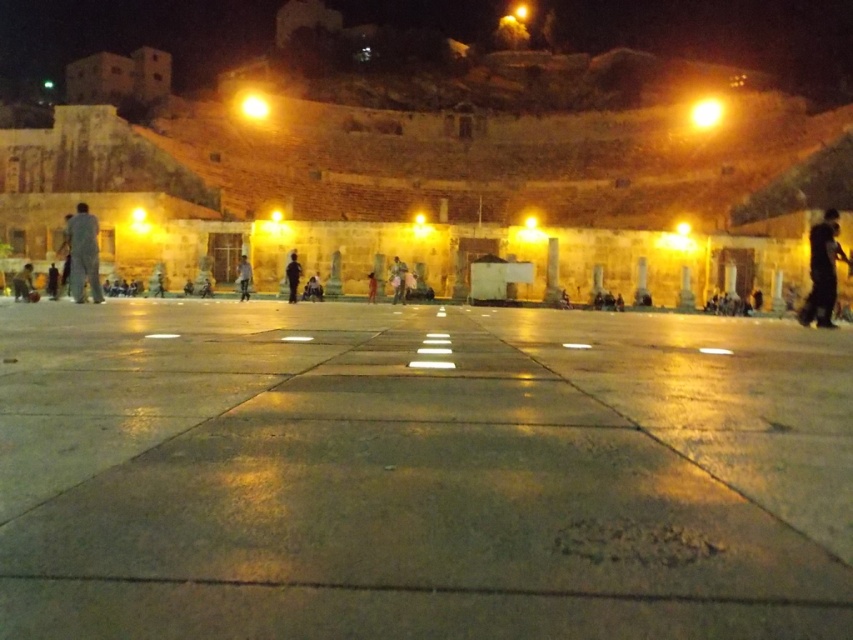
Between black matte person at right and light blue fabric at left, which one has less height?

Standing shorter between the two is black matte person at right.

Is black matte person at right shorter than light blue fabric at left?

Correct, black matte person at right is not as tall as light blue fabric at left.

Where is `black matte person at right`? Image resolution: width=853 pixels, height=640 pixels. black matte person at right is located at coordinates (822, 269).

I want to click on black matte person at right, so click(x=822, y=269).

Is light brown leather jacket at center above light blue jeans at center?

Indeed, light brown leather jacket at center is positioned over light blue jeans at center.

The height and width of the screenshot is (640, 853). What do you see at coordinates (398, 280) in the screenshot? I see `light brown leather jacket at center` at bounding box center [398, 280].

At what (x,y) coordinates should I click in order to perform the action: click on light brown leather jacket at center. Please return your answer as a coordinate pair (x, y). Looking at the image, I should click on (398, 280).

Between light brown leather jacket at lower left and smooth red dress at center, which one is positioned higher?

smooth red dress at center

The width and height of the screenshot is (853, 640). Identify the location of light brown leather jacket at lower left. (22, 284).